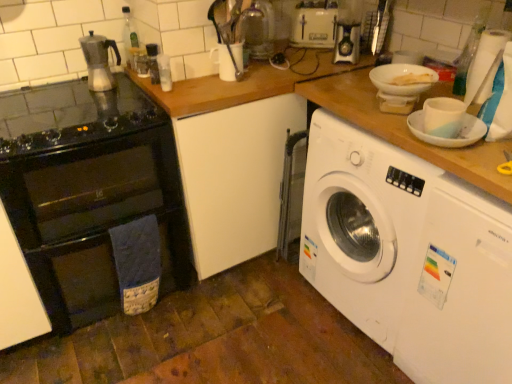
Question: Considering the relative positions of black glass oven at left and white glossy bowl at upper right in the image provided, is black glass oven at left to the left or to the right of white glossy bowl at upper right?

Choices:
 (A) right
 (B) left

Answer: (B)

Question: Is black glass oven at left taller or shorter than white glossy bowl at upper right?

Choices:
 (A) tall
 (B) short

Answer: (A)

Question: Estimate the real-world distances between objects in this image. Which object is closer to the white plastic toaster at upper center, the 2th appliance from the right?

Choices:
 (A) white plastic washing machine at lower right, which is the 2th washing machine in back-to-front order
 (B) black glass gas stove at left
 (C) transparent plastic bottle at upper right, which is counted as the 1th bottle, starting from the right
 (D) white paper at upper right
 (E) white glossy washing machine at right, which is counted as the 2th washing machine, starting from the front

Answer: (C)

Question: Which of these objects is positioned closest to the white glossy cup at upper right, the 1th appliance from the bottom?

Choices:
 (A) transparent glass bottle at center, acting as the 2th bottle starting from the right
 (B) white paper at upper right
 (C) black glass gas stove at left
 (D) white glossy washing machine at right, which is counted as the 2th washing machine, starting from the front
 (E) white glossy bowl at upper right

Answer: (B)